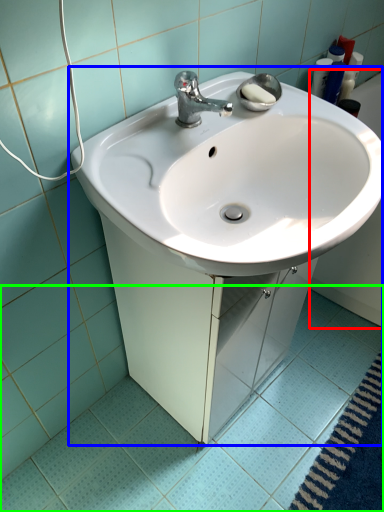
Question: Which is nearer to the bath (highlighted by a red box)? sink (highlighted by a blue box) or ceramic tile (highlighted by a green box).

Choices:
 (A) sink
 (B) ceramic tile

Answer: (B)